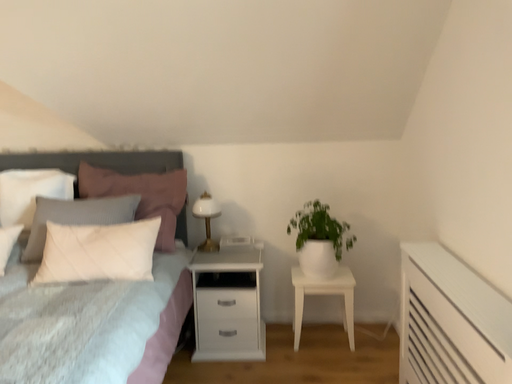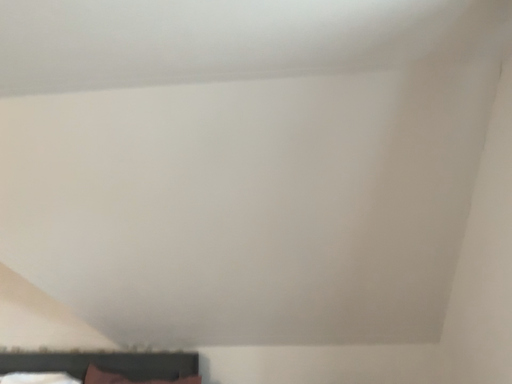
Question: Which way did the camera rotate in the video?

Choices:
 (A) rotated downward
 (B) rotated upward

Answer: (B)